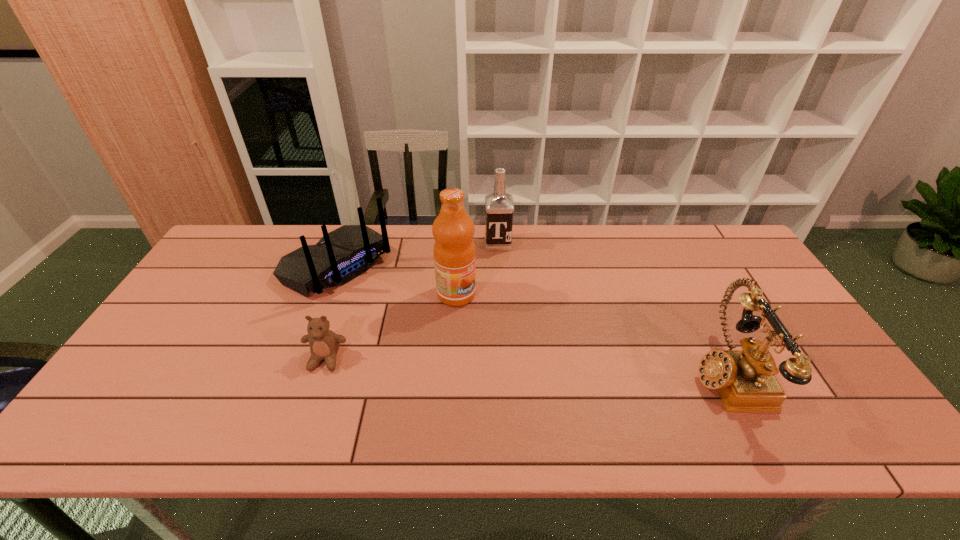
Locate an element on the screen. Image resolution: width=960 pixels, height=540 pixels. vacant space on the desktop that is between the teddy bear and the telephone and is positioned on the label side of the tallest object is located at coordinates (564, 367).

I want to click on free space on the desktop that is between the teddy bear and the rightmost object and is positioned on the front label of the fourth shortest object, so click(x=510, y=365).

You are a GUI agent. You are given a task and a screenshot of the screen. Output one action in this format:
    pyautogui.click(x=<x>, y=<y>)
    Task: Click on the free space on the desktop that is between the shortest object and the rightmost object and is positioned on the back of the router
    This screenshot has width=960, height=540.
    Given the screenshot: What is the action you would take?
    (x=479, y=364)